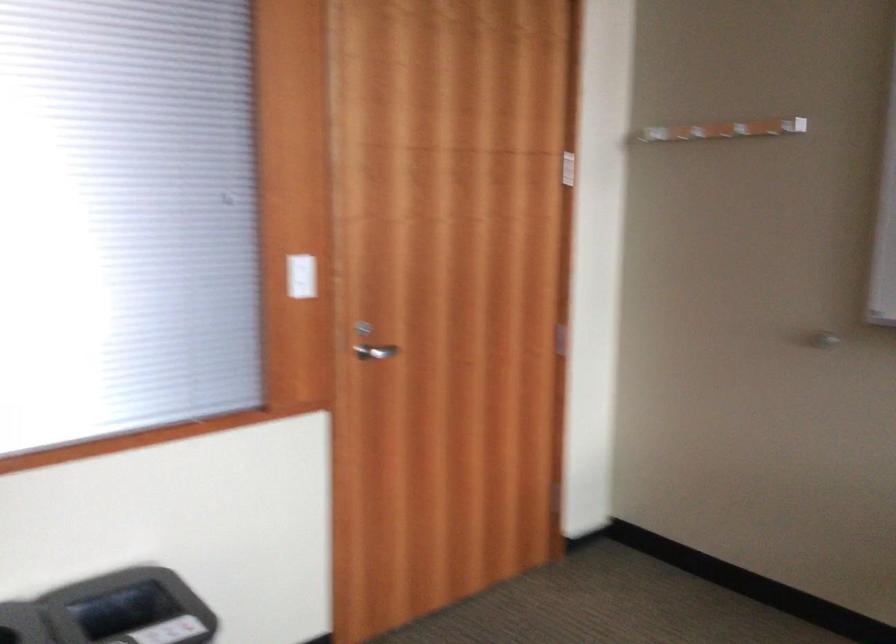
What do you see at coordinates (300, 276) in the screenshot? This screenshot has width=896, height=644. I see `the white light switch` at bounding box center [300, 276].